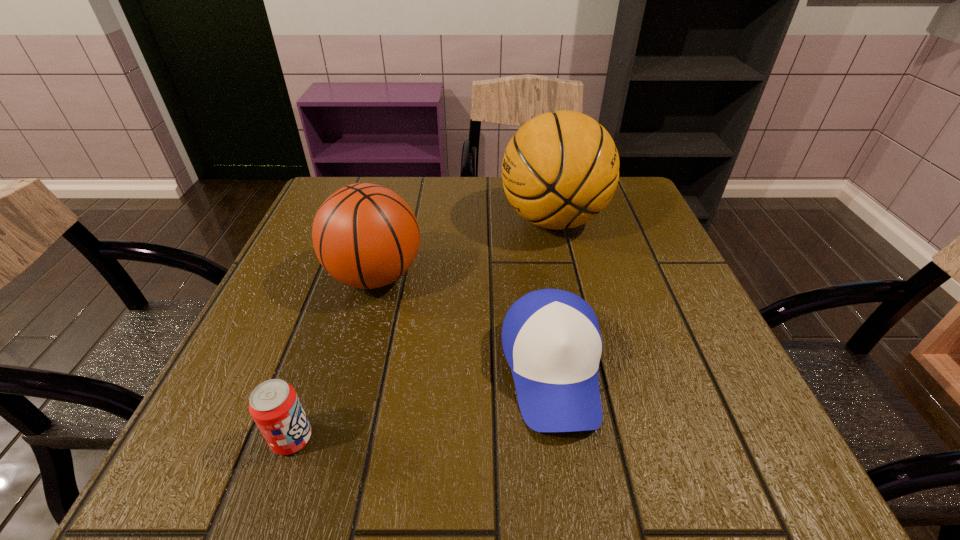
The image size is (960, 540). I want to click on blank area at the near edge, so click(492, 441).

I want to click on vacant region at the left edge of the desktop, so click(327, 364).

The width and height of the screenshot is (960, 540). I want to click on vacant space at the right edge, so click(x=606, y=253).

Where is `vacant point at the near left corner`? vacant point at the near left corner is located at coordinates (280, 483).

Locate an element on the screen. The width and height of the screenshot is (960, 540). free point at the far right corner is located at coordinates (617, 226).

Locate an element on the screen. This screenshot has height=540, width=960. free space at the near right corner is located at coordinates (737, 456).

Find the location of a particular element. free space between the left basketball and the soda can is located at coordinates (334, 357).

Find the location of a particular element. vacant area that lies between the left basketball and the soda can is located at coordinates (334, 357).

Find the location of a particular element. This screenshot has width=960, height=540. free area in between the taller basketball and the left basketball is located at coordinates (465, 248).

Locate an element on the screen. free space between the left basketball and the baseball cap is located at coordinates (464, 323).